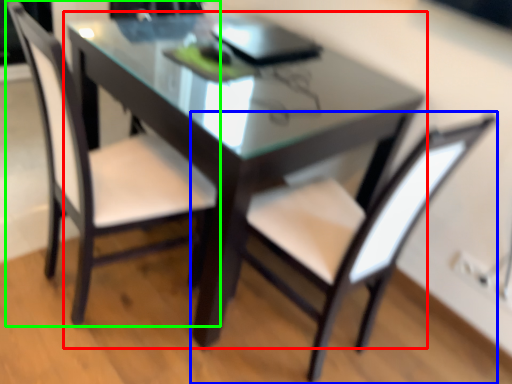
Question: Which is farther away from table (highlighted by a red box)? chair (highlighted by a blue box) or chair (highlighted by a green box)?

Choices:
 (A) chair
 (B) chair

Answer: (A)